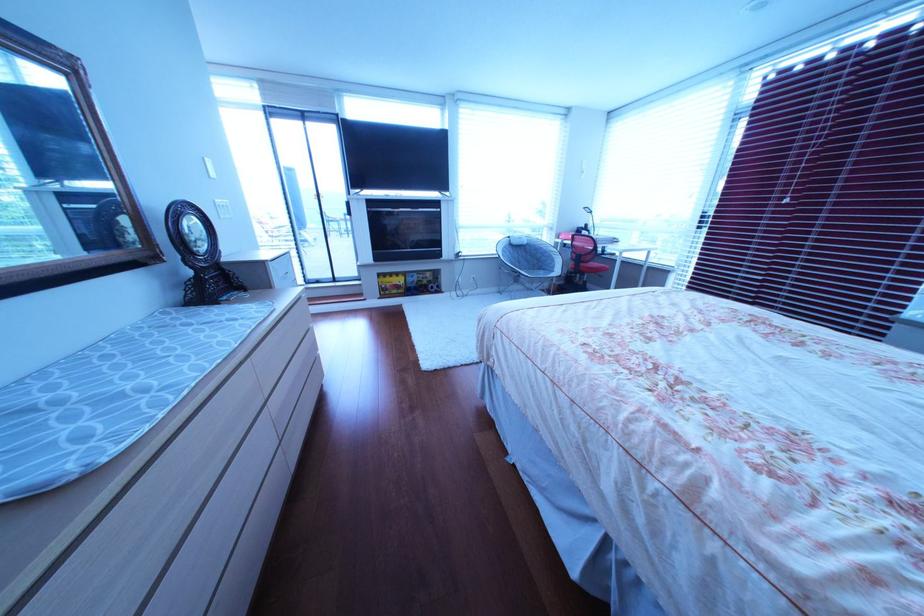
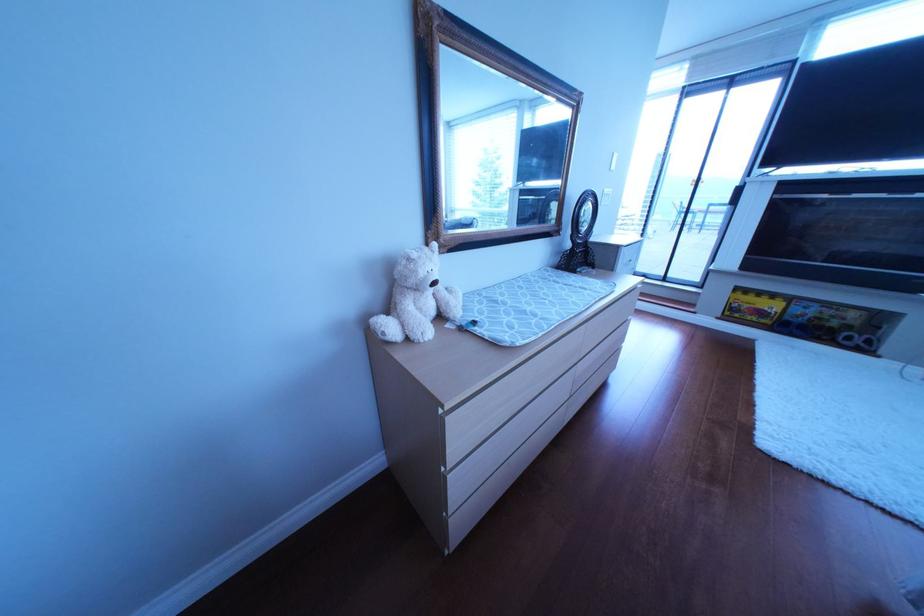
Where in the second image is the point corresponding to [394,301] from the first image?

(733, 320)